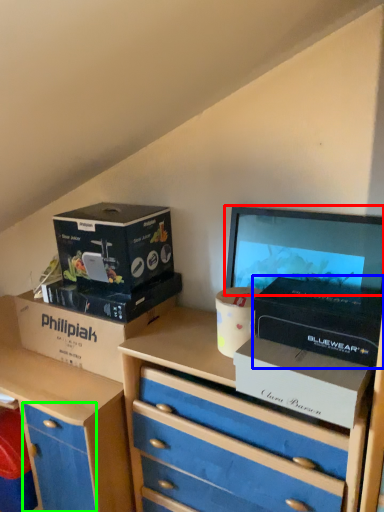
Question: Which object is the closest to the computer monitor (highlighted by a red box)? Choose among these: box (highlighted by a blue box) or drawer (highlighted by a green box).

Choices:
 (A) box
 (B) drawer

Answer: (A)